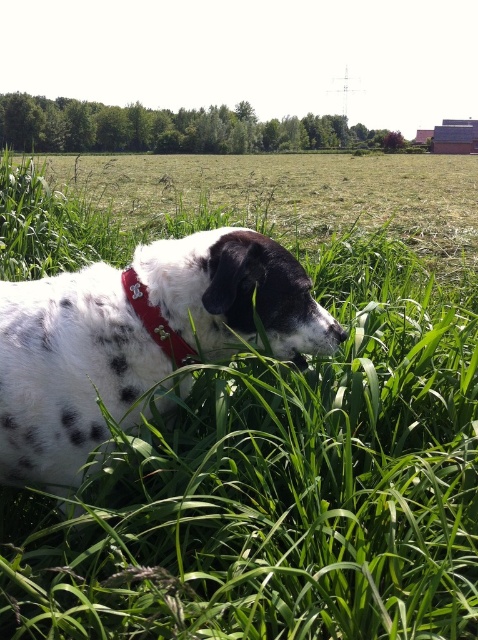
You are a GUI agent. You are given a task and a screenshot of the screen. Output one action in this format:
    pyautogui.click(x=<x>, y=<y>)
    Task: Click on the spotted fur dog at lower left
    Image resolution: width=478 pixels, height=640 pixels.
    Given the screenshot: What is the action you would take?
    pyautogui.click(x=137, y=339)

At what (x,y) coordinates should I click in order to perform the action: click on spotted fur dog at lower left. Please return your answer as a coordinate pair (x, y). The height and width of the screenshot is (640, 478). Looking at the image, I should click on (137, 339).